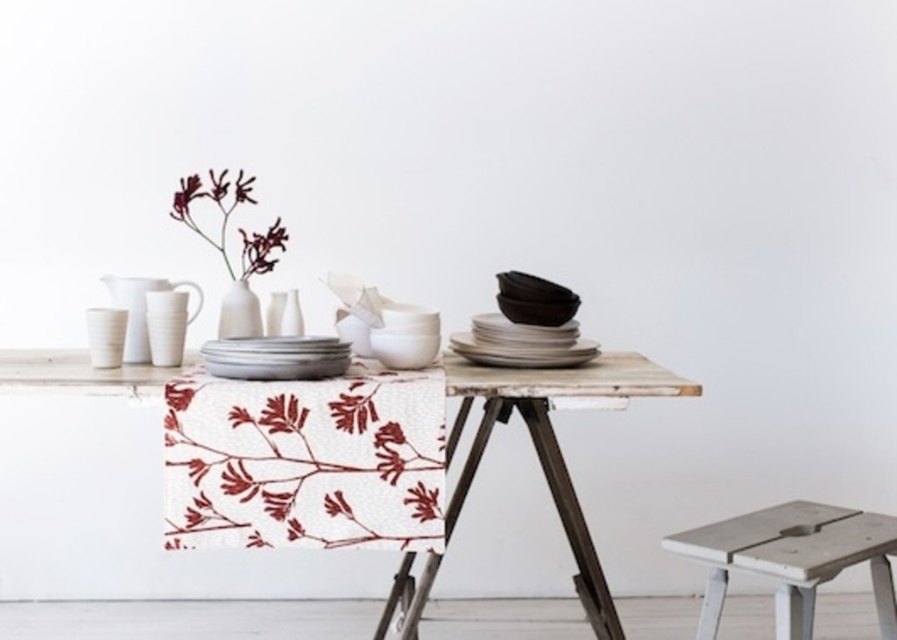
Question: In this image, where is white matte stool at lower right located relative to white matte vase at center?

Choices:
 (A) below
 (B) above

Answer: (A)

Question: Which is nearer to the white matte vase at center?

Choices:
 (A) white matte platter at center
 (B) white matte stool at lower right
 (C) white wood table at center
 (D) matte white vase at upper left

Answer: (A)

Question: Can you confirm if white matte stool at lower right is positioned to the right of white ceramic vase at left?

Choices:
 (A) yes
 (B) no

Answer: (A)

Question: Which point appears closest to the camera in this image?

Choices:
 (A) (240, 413)
 (B) (227, 189)

Answer: (A)

Question: Estimate the real-world distances between objects in this image. Which object is closer to the white matte vase at center?

Choices:
 (A) white wood table at center
 (B) white matte platter at center

Answer: (B)

Question: Does white matte stool at lower right have a smaller size compared to matte white vase at upper left?

Choices:
 (A) no
 (B) yes

Answer: (B)